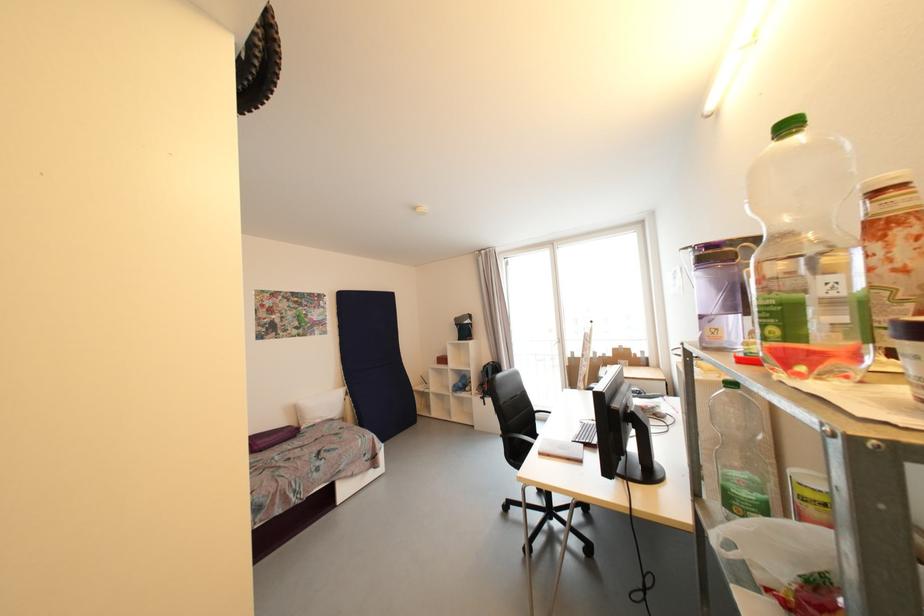
The height and width of the screenshot is (616, 924). Identify the location of purple water pitcher. (807, 257).